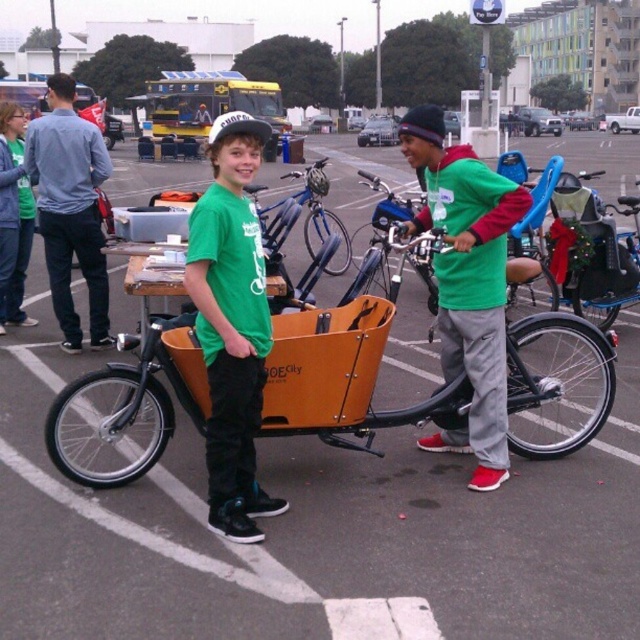
Looking at this image, is yellow matte cargo bike at center behind matte black bicycle at center?

Yes, yellow matte cargo bike at center is further from the viewer.

Between yellow matte cargo bike at center and matte black bicycle at center, which one appears on the left side from the viewer's perspective?

From the viewer's perspective, yellow matte cargo bike at center appears more on the left side.

The width and height of the screenshot is (640, 640). What do you see at coordinates (212, 104) in the screenshot? I see `yellow matte cargo bike at center` at bounding box center [212, 104].

You are a GUI agent. You are given a task and a screenshot of the screen. Output one action in this format:
    pyautogui.click(x=<x>, y=<y>)
    Task: Click on the yellow matte cargo bike at center
    Image resolution: width=640 pixels, height=640 pixels.
    Given the screenshot: What is the action you would take?
    pyautogui.click(x=212, y=104)

Does point (228, 268) come in front of point (268, 109)?

Yes, point (228, 268) is closer to viewer.

Image resolution: width=640 pixels, height=640 pixels. I want to click on green matte shirt at center, so click(x=230, y=324).

The width and height of the screenshot is (640, 640). What are the coordinates of `green matte shirt at center` in the screenshot? It's located at (230, 324).

Between blue denim jeans at left and matte green t-shirt at center, which one appears on the right side from the viewer's perspective?

blue denim jeans at left

What do you see at coordinates (70, 209) in the screenshot?
I see `blue denim jeans at left` at bounding box center [70, 209].

What are the coordinates of `blue denim jeans at left` in the screenshot? It's located at (70, 209).

Identify the location of blue denim jeans at left. (70, 209).